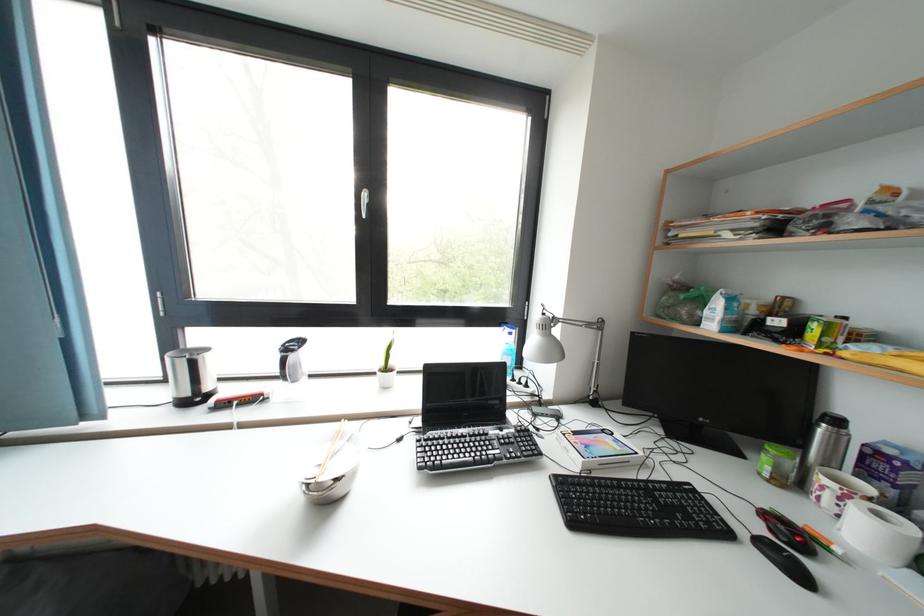
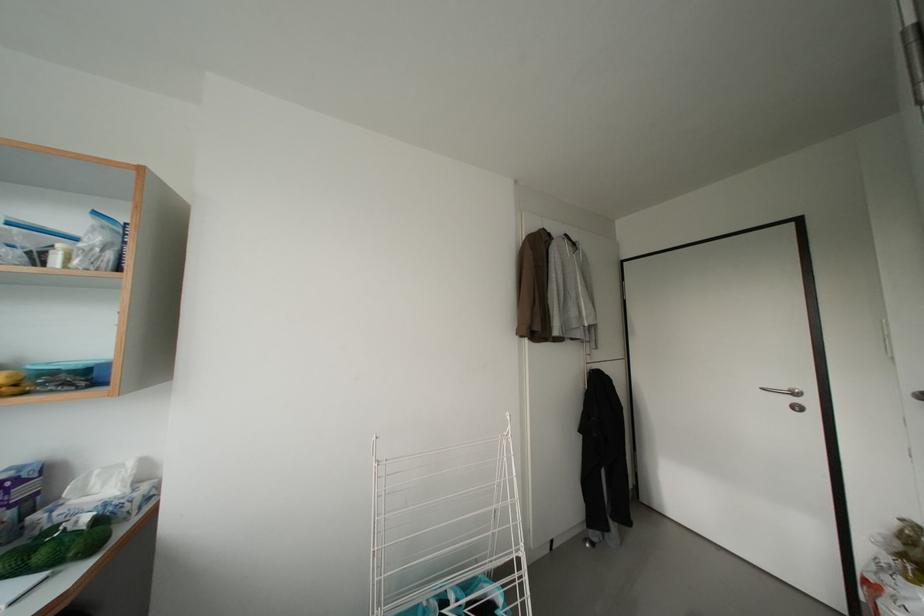
The point at (895,456) is marked in the first image. Where is the corresponding point in the second image?

(11, 482)